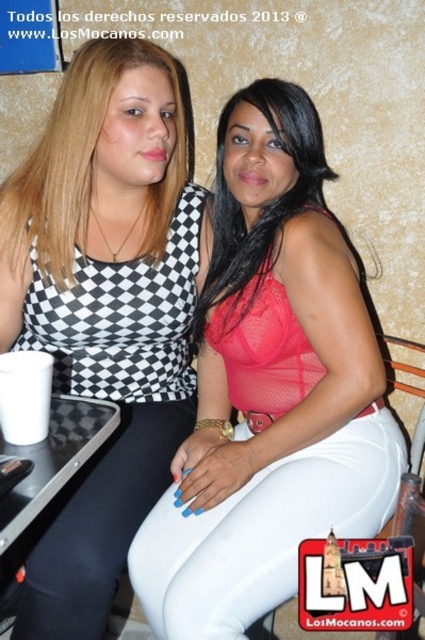
You are a fashion designer observing two women at an event. You need to decide which outfit to recommend for a client who prefers slim fit clothing. The client will be attending a casual gathering. Which of the two outfits, the black checkered tank top at upper left or the matte red blouse at center, is more suitable for a slim fit?

The black checkered tank top at upper left is thinner than the matte red blouse at center, making it more suitable for a slim fit.